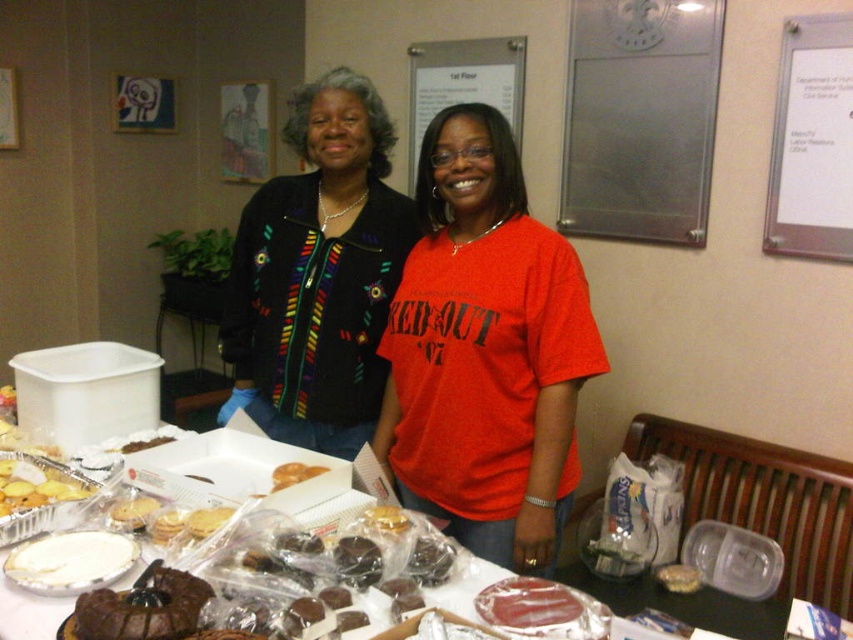
Is point (314, 252) less distant than point (628, 436)?

Yes, it is in front of point (628, 436).

What do you see at coordinates (318, 273) in the screenshot? I see `multicolored embroidered sweater at center` at bounding box center [318, 273].

Identify the location of multicolored embroidered sweater at center. This screenshot has height=640, width=853. (318, 273).

Where is `multicolored embroidered sweater at center`? This screenshot has width=853, height=640. multicolored embroidered sweater at center is located at coordinates (318, 273).

Who is taller, matte black jacket at center or white paper at upper right?

Standing taller between the two is matte black jacket at center.

Which is more to the right, matte black jacket at center or white paper at upper right?

Positioned to the right is white paper at upper right.

Does point (393, 465) lie in front of point (790, 35)?

Yes, it is.

What are the coordinates of `matte black jacket at center` in the screenshot? It's located at (485, 349).

Who is positioned more to the right, white paper at upper right or golden brown foil tray at lower left?

From the viewer's perspective, white paper at upper right appears more on the right side.

Find the location of a particular element. This screenshot has height=640, width=853. white paper at upper right is located at coordinates (811, 141).